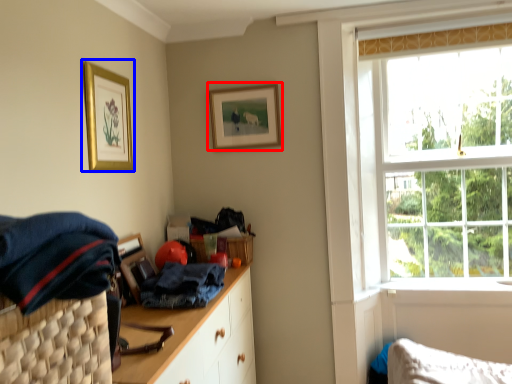
Question: Which object appears closest to the camera in this image, picture frame (highlighted by a red box) or picture frame (highlighted by a blue box)?

Choices:
 (A) picture frame
 (B) picture frame

Answer: (B)